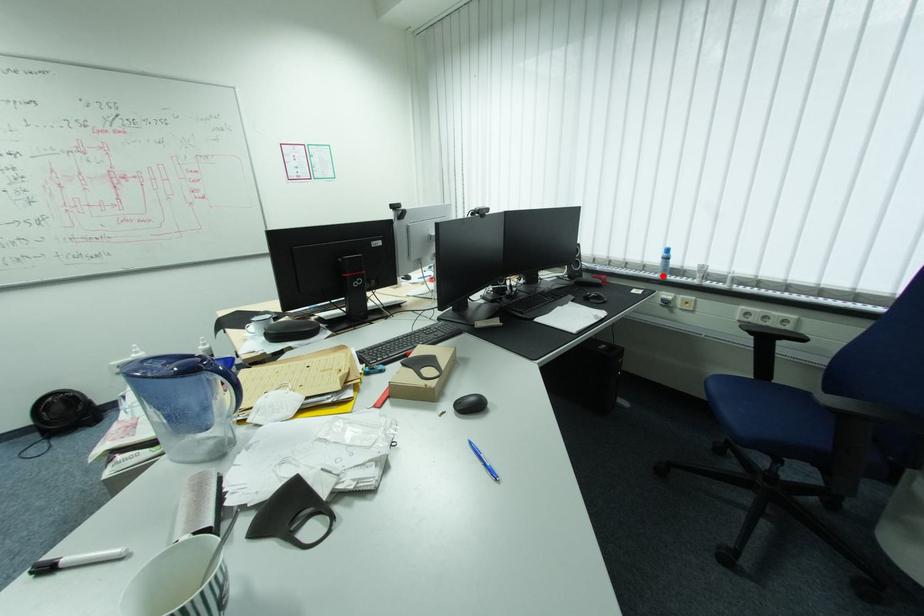
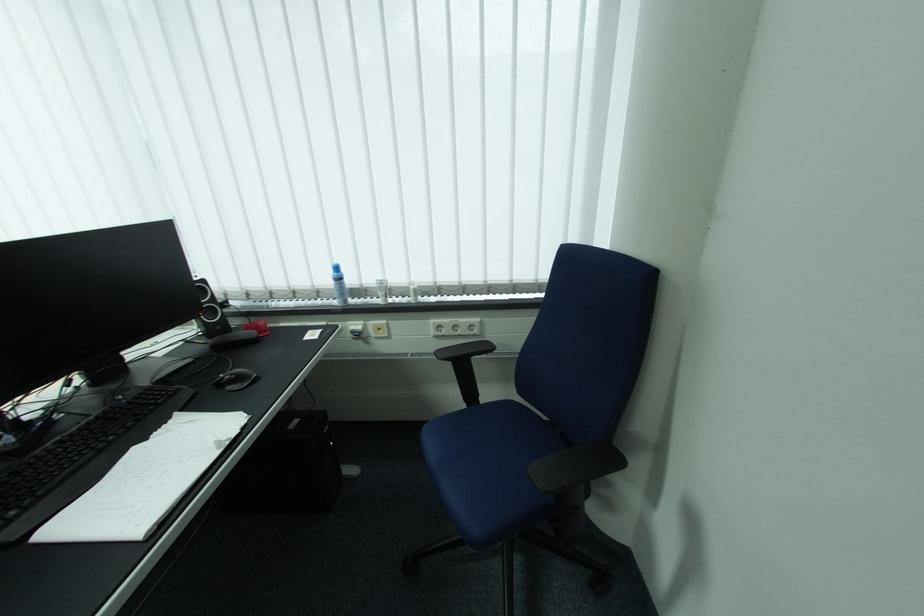
Question: I am providing you with two images of the same scene from different viewpoints. A red point is marked on the first image. Can you still see the location of the red point in image 2?

Choices:
 (A) Yes
 (B) No

Answer: (A)